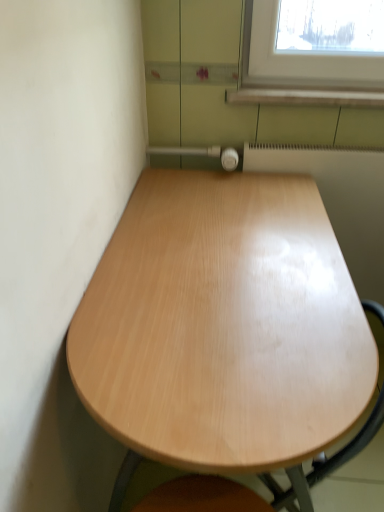
Where is `light wood table at center`? The width and height of the screenshot is (384, 512). light wood table at center is located at coordinates (223, 325).

What do you see at coordinates (223, 325) in the screenshot? The image size is (384, 512). I see `light wood table at center` at bounding box center [223, 325].

Describe the element at coordinates (340, 201) in the screenshot. The height and width of the screenshot is (512, 384). I see `white glossy radiator at upper right` at that location.

The height and width of the screenshot is (512, 384). I want to click on white glossy radiator at upper right, so click(x=340, y=201).

Measure the distance between point [350,214] and camera.

4.73 feet.

This screenshot has height=512, width=384. What are the coordinates of `light wood table at center` in the screenshot? It's located at (223, 325).

In the scene shown: Would you say light wood table at center is to the left or to the right of white glossy radiator at upper right in the picture?

Based on their positions, light wood table at center is located to the left of white glossy radiator at upper right.

Does light wood table at center lie behind white glossy radiator at upper right?

No, light wood table at center is closer to the camera.

Considering the positions of point (131, 209) and point (269, 159), is point (131, 209) closer or farther from the camera than point (269, 159)?

Point (131, 209).

Looking at this image, from the image's perspective, does light wood table at center appear higher than white glossy radiator at upper right?

No, from the image's perspective, light wood table at center is not over white glossy radiator at upper right.

Looking at this image, from a real-world perspective, is light wood table at center beneath white glossy radiator at upper right?

Yes, from a real-world perspective, light wood table at center is below white glossy radiator at upper right.

In terms of width, does light wood table at center look wider or thinner when compared to white glossy radiator at upper right?

Clearly, light wood table at center has more width compared to white glossy radiator at upper right.

Considering the relative sizes of light wood table at center and white glossy radiator at upper right in the image provided, is light wood table at center shorter than white glossy radiator at upper right?

No, light wood table at center is not shorter than white glossy radiator at upper right.

Based on their sizes in the image, would you say light wood table at center is bigger or smaller than white glossy radiator at upper right?

light wood table at center is bigger than white glossy radiator at upper right.

Would you say white glossy radiator at upper right is part of light wood table at center's contents?

No, white glossy radiator at upper right is not a part of light wood table at center.

Is light wood table at center far away from white glossy radiator at upper right?

No, light wood table at center is not far away from white glossy radiator at upper right.

Is white glossy radiator at upper right at the back of light wood table at center?

No, white glossy radiator at upper right is not at the back of light wood table at center.

How many degrees apart are the facing directions of light wood table at center and white glossy radiator at upper right?

light wood table at center and white glossy radiator at upper right are facing 89.7 degrees away from each other.

Identify the location of table below the white glossy radiator at upper right (from a real-world perspective). click(x=223, y=325).

Is white glossy radiator at upper right to the left of light wood table at center from the viewer's perspective?

No, white glossy radiator at upper right is not to the left of light wood table at center.

Is white glossy radiator at upper right in front of or behind light wood table at center in the image?

Visually, white glossy radiator at upper right is located behind light wood table at center.

Does point (300, 165) appear closer or farther from the camera than point (276, 454)?

Point (300, 165) is farther from the camera than point (276, 454).

From the image's perspective, which is above, white glossy radiator at upper right or light wood table at center?

white glossy radiator at upper right is shown above in the image.

From a real-world perspective, is white glossy radiator at upper right under light wood table at center?

Actually, white glossy radiator at upper right is physically above light wood table at center in the real world.

Can you confirm if white glossy radiator at upper right is thinner than light wood table at center?

Yes, white glossy radiator at upper right is thinner than light wood table at center.

Consider the image. Is white glossy radiator at upper right taller or shorter than light wood table at center?

Considering their sizes, white glossy radiator at upper right has less height than light wood table at center.

Based on their sizes in the image, would you say white glossy radiator at upper right is bigger or smaller than light wood table at center?

white glossy radiator at upper right is smaller than light wood table at center.

Would you say white glossy radiator at upper right is inside or outside light wood table at center?

white glossy radiator at upper right cannot be found inside light wood table at center.

Is white glossy radiator at upper right not close to light wood table at center?

No, white glossy radiator at upper right is not far away from light wood table at center.

Does white glossy radiator at upper right turn towards light wood table at center?

Yes, white glossy radiator at upper right faces towards light wood table at center.

Can you tell me how much white glossy radiator at upper right and light wood table at center differ in facing direction?

white glossy radiator at upper right and light wood table at center are facing 89.7 degrees away from each other.

How far apart are white glossy radiator at upper right and light wood table at center?

A distance of 18.37 inches exists between white glossy radiator at upper right and light wood table at center.

At what (x,y) coordinates should I click in order to perform the action: click on table that appears on the left of white glossy radiator at upper right. Please return your answer as a coordinate pair (x, y). This screenshot has width=384, height=512. Looking at the image, I should click on (223, 325).

Find the location of a particular element. The height and width of the screenshot is (512, 384). table directly beneath the white glossy radiator at upper right (from a real-world perspective) is located at coordinates pyautogui.click(x=223, y=325).

Where is `table below the white glossy radiator at upper right (from the image's perspective)`? The image size is (384, 512). table below the white glossy radiator at upper right (from the image's perspective) is located at coordinates (223, 325).